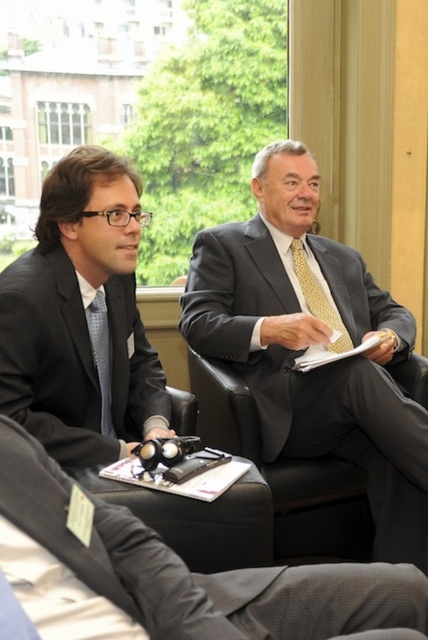
Which of these two, black matte business suit at center or yellowtexturetie at center, stands shorter?

With less height is yellowtexturetie at center.

Is point (255, 596) more distant than point (300, 284)?

No, it is in front of (300, 284).

Between point (228, 611) and point (348, 340), which one is positioned behind?

The point (348, 340) is more distant.

Image resolution: width=428 pixels, height=640 pixels. I want to click on black matte business suit at center, so click(169, 573).

Does black matte business suit at center lie behind blue dotted tie at left?

No, black matte business suit at center is in front of blue dotted tie at left.

Is point (196, 616) positioned before point (106, 304)?

That is True.

Who is more forward, (377, 580) or (107, 410)?

Point (377, 580) is more forward.

Where is `black matte business suit at center`? black matte business suit at center is located at coordinates (169, 573).

Between matte black suit at left and blue dotted tie at left, which one is positioned lower?

Positioned lower is blue dotted tie at left.

Is point (62, 168) farther from camera compared to point (103, 298)?

No.

Find the location of `matte black suit at left`. matte black suit at left is located at coordinates (82, 317).